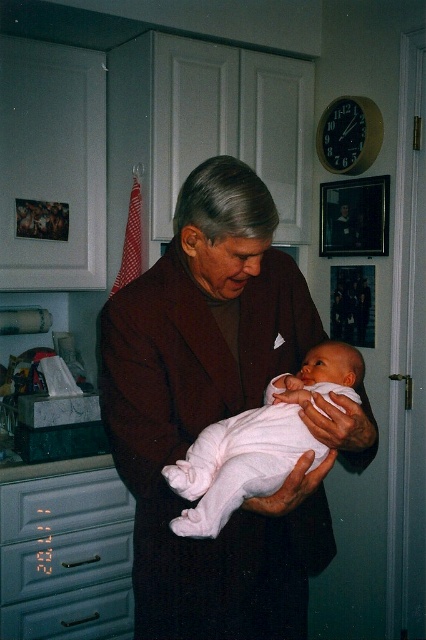
Question: Can you confirm if dark brown wool coat at center is smaller than white soft fabric newborn at center?

Choices:
 (A) no
 (B) yes

Answer: (A)

Question: Does dark brown wool coat at center appear on the right side of white soft fabric newborn at center?

Choices:
 (A) no
 (B) yes

Answer: (A)

Question: In this image, where is dark brown wool coat at center located relative to white soft fabric newborn at center?

Choices:
 (A) above
 (B) below

Answer: (B)

Question: Among these objects, which one is nearest to the camera?

Choices:
 (A) white soft fabric newborn at center
 (B) dark brown wool coat at center

Answer: (A)